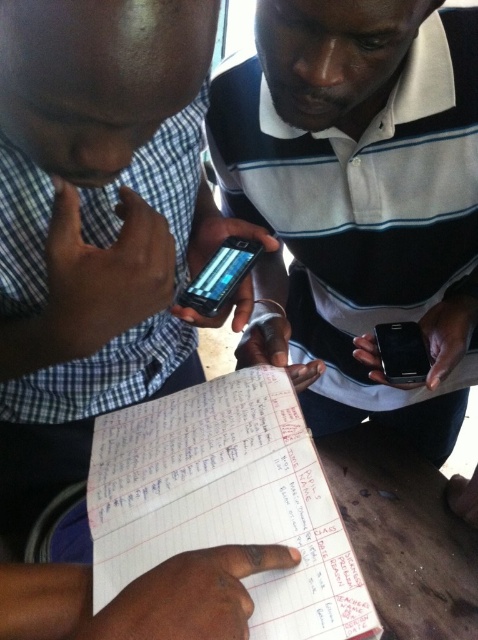
Can you confirm if satin black smartphone at center is bigger than black glossy smartphone at center?

Correct, satin black smartphone at center is larger in size than black glossy smartphone at center.

Does satin black smartphone at center have a greater height compared to black glossy smartphone at center?

Yes.

This screenshot has height=640, width=478. What do you see at coordinates (220, 275) in the screenshot? I see `satin black smartphone at center` at bounding box center [220, 275].

Locate an element on the screen. The image size is (478, 640). satin black smartphone at center is located at coordinates (220, 275).

Between white paper at center and black glossy smartphone at center, which one appears on the left side from the viewer's perspective?

Positioned to the left is white paper at center.

Measure the distance between point (249, 390) and camera.

Point (249, 390) is 25.35 inches from camera.

Image resolution: width=478 pixels, height=640 pixels. What do you see at coordinates (227, 500) in the screenshot?
I see `white paper at center` at bounding box center [227, 500].

Locate an element on the screen. The height and width of the screenshot is (640, 478). white paper at center is located at coordinates (227, 500).

Based on the photo, who is shorter, black striped shirt at center or black glossy smartphone at center?

black glossy smartphone at center

Is black striped shirt at center in front of black glossy smartphone at center?

Yes, black striped shirt at center is in front of black glossy smartphone at center.

Find the location of a particular element. black striped shirt at center is located at coordinates (358, 200).

At what (x,y) coordinates should I click in order to perform the action: click on black striped shirt at center. Please return your answer as a coordinate pair (x, y). Image resolution: width=478 pixels, height=640 pixels. Looking at the image, I should click on coord(358,200).